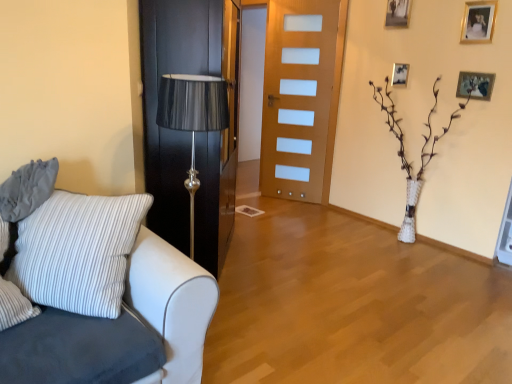
Question: Does gold metallic picture frame at upper right, marked as the second picture frame in a top-to-bottom arrangement, lie in front of wooden picture frame at upper right, which is counted as the third picture frame, starting from the right?

Choices:
 (A) yes
 (B) no

Answer: (A)

Question: Is wooden picture frame at upper right, which is counted as the 2th picture frame, starting from the bottom, surrounded by gold metallic picture frame at upper right, the second picture frame from the right?

Choices:
 (A) yes
 (B) no

Answer: (B)

Question: From a real-world perspective, does gold metallic picture frame at upper right, the second picture frame from the right, stand above wooden picture frame at upper right, which is counted as the 2th picture frame, starting from the bottom?

Choices:
 (A) yes
 (B) no

Answer: (A)

Question: From a real-world perspective, is gold metallic picture frame at upper right, acting as the third picture frame starting from the left, under wooden picture frame at upper right, which is counted as the 2th picture frame, starting from the bottom?

Choices:
 (A) no
 (B) yes

Answer: (A)

Question: Can you confirm if gold metallic picture frame at upper right, marked as the second picture frame in a top-to-bottom arrangement, is smaller than wooden picture frame at upper right, positioned as the second picture frame in left-to-right order?

Choices:
 (A) no
 (B) yes

Answer: (A)

Question: Is gold metallic picture frame at upper right, acting as the third picture frame starting from the left, taller than wooden picture frame at upper right, which is counted as the 2th picture frame, starting from the bottom?

Choices:
 (A) yes
 (B) no

Answer: (A)

Question: Can you see gold metallic picture frame at upper right, which is the 3th picture frame in bottom-to-top order, touching wooden picture frame at upper right, which appears as the fourth picture frame when viewed from the right?

Choices:
 (A) yes
 (B) no

Answer: (B)

Question: Can you confirm if gold metallic picture frame at upper right, the second picture frame from the right, is positioned to the left of wooden picture frame at upper right, the 1th picture frame from the top?

Choices:
 (A) yes
 (B) no

Answer: (B)

Question: From the image's perspective, is gold metallic picture frame at upper right, which is the 3th picture frame in bottom-to-top order, on wooden picture frame at upper right, the 1th picture frame from the top?

Choices:
 (A) no
 (B) yes

Answer: (A)

Question: From a real-world perspective, is gold metallic picture frame at upper right, the second picture frame from the right, over wooden picture frame at upper right, the 1th picture frame from the top?

Choices:
 (A) no
 (B) yes

Answer: (A)

Question: Is gold metallic picture frame at upper right, which is the 3th picture frame in bottom-to-top order, completely or partially outside of wooden picture frame at upper right, positioned as the 4th picture frame in bottom-to-top order?

Choices:
 (A) yes
 (B) no

Answer: (A)

Question: Can wooden picture frame at upper right, which appears as the fourth picture frame when viewed from the right, be found inside gold metallic picture frame at upper right, the second picture frame from the right?

Choices:
 (A) yes
 (B) no

Answer: (B)

Question: Is gold metallic picture frame at upper right, the second picture frame from the right, smaller than white fabric couch at left?

Choices:
 (A) no
 (B) yes

Answer: (B)